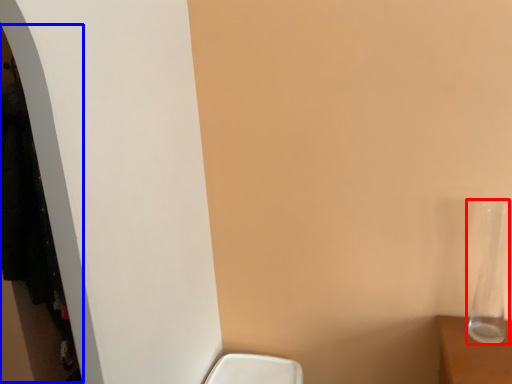
Question: Which point is further to the camera, glass vase (highlighted by a red box) or closet (highlighted by a blue box)?

Choices:
 (A) glass vase
 (B) closet

Answer: (B)